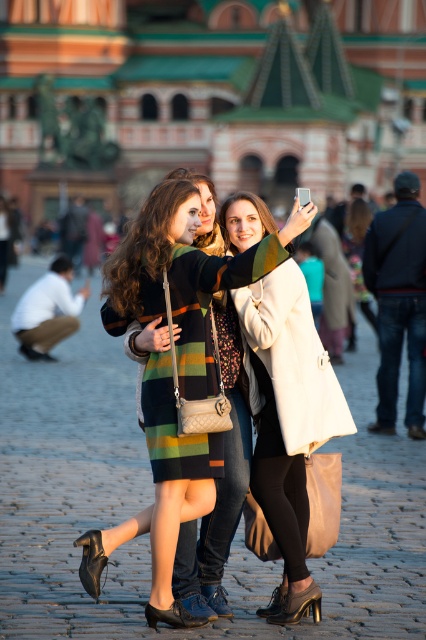
Can you confirm if white leather coat at center is taller than dark blue jeans at right?

Yes.

Which of these two, white leather coat at center or dark blue jeans at right, stands shorter?

dark blue jeans at right

Who is more forward, (x=298, y=356) or (x=388, y=241)?

Point (x=298, y=356) is more forward.

The height and width of the screenshot is (640, 426). What are the coordinates of `white leather coat at center` in the screenshot? It's located at (288, 422).

The width and height of the screenshot is (426, 640). In order to click on striped wool dress at center in this screenshot , I will do (183, 275).

This screenshot has height=640, width=426. I want to click on striped wool dress at center, so click(x=183, y=275).

Which of these two, striped wool dress at center or dark blue jeans at right, stands taller?

striped wool dress at center

Identify the location of striped wool dress at center. (183, 275).

The height and width of the screenshot is (640, 426). Identify the location of striped wool dress at center. (183, 275).